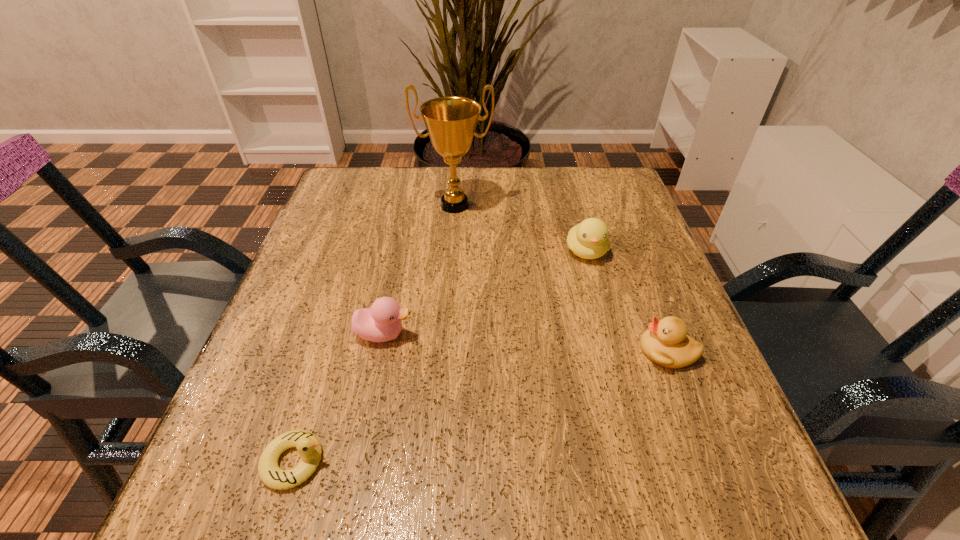
Identify the location of vacant space at the right edge of the desktop. (637, 218).

You are a GUI agent. You are given a task and a screenshot of the screen. Output one action in this format:
    pyautogui.click(x=<x>, y=<y>)
    Task: Click on the free space at the far left corner of the desktop
    
    Given the screenshot: What is the action you would take?
    pyautogui.click(x=358, y=191)

This screenshot has width=960, height=540. Find the location of `vacant region at the near left corner of the desktop`. vacant region at the near left corner of the desktop is located at coordinates (227, 509).

I want to click on free space at the far right corner, so click(633, 207).

Find the location of a particular element. This screenshot has height=540, width=960. vacant area at the near right corner of the desktop is located at coordinates (674, 522).

You are a GUI agent. You are given a task and a screenshot of the screen. Output one action in this format:
    pyautogui.click(x=<x>, y=<y>)
    Task: Click on the free space between the rightmost object and the third duckling from left to right
    This screenshot has width=960, height=540.
    Given the screenshot: What is the action you would take?
    pyautogui.click(x=627, y=301)

Find the location of a particular element. This screenshot has height=540, width=960. vacant point located between the rightmost duckling and the nearest object is located at coordinates (481, 407).

The height and width of the screenshot is (540, 960). In order to click on vacant space that is in between the second shortest duckling and the second farthest object in this screenshot , I will do `click(627, 301)`.

Where is `free area in between the rightmost duckling and the shortest duckling`? Image resolution: width=960 pixels, height=540 pixels. free area in between the rightmost duckling and the shortest duckling is located at coordinates point(481,407).

You are a GUI agent. You are given a task and a screenshot of the screen. Output one action in this format:
    pyautogui.click(x=<x>, y=<y>)
    Task: Click on the unoccupied area between the rightmost object and the shortest object
    The height and width of the screenshot is (540, 960).
    Given the screenshot: What is the action you would take?
    pyautogui.click(x=481, y=407)